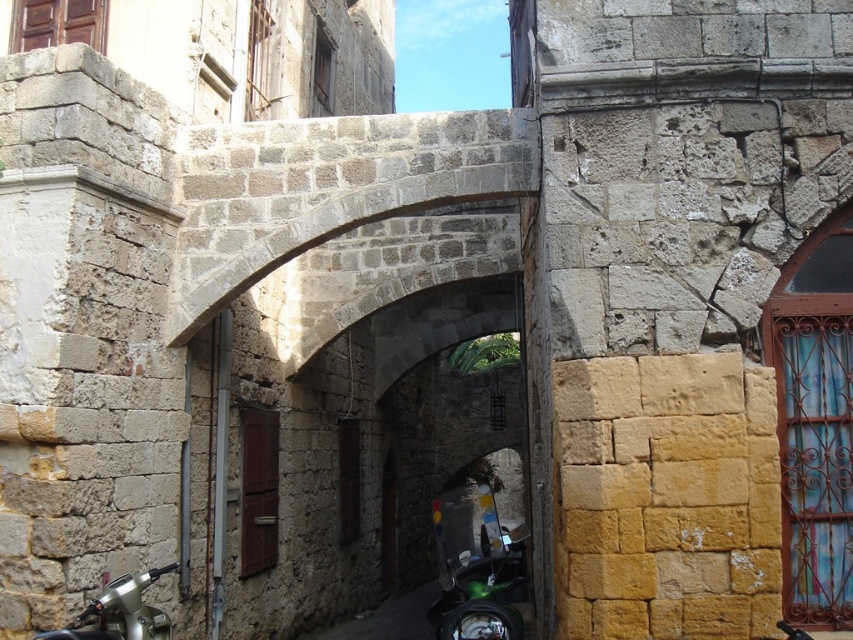
Based on the photo, how far apart are shiny metallic motorcycle at lower right and metallic silver motorcycle at lower left?

shiny metallic motorcycle at lower right is 20.78 meters from metallic silver motorcycle at lower left.

Can you confirm if shiny metallic motorcycle at lower right is smaller than metallic silver motorcycle at lower left?

Actually, shiny metallic motorcycle at lower right might be larger than metallic silver motorcycle at lower left.

This screenshot has width=853, height=640. Identify the location of shiny metallic motorcycle at lower right. (476, 566).